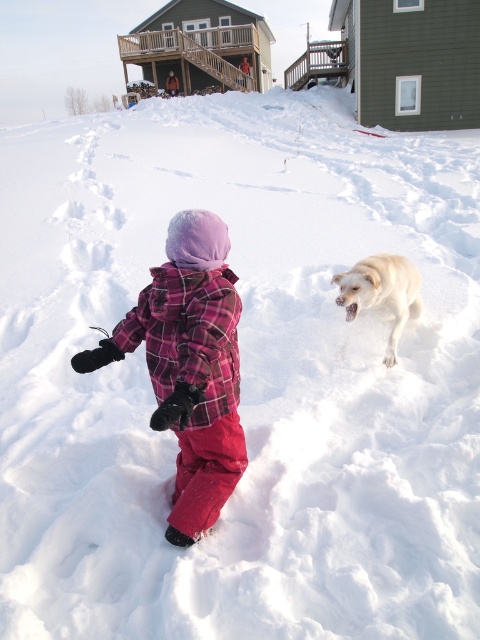
Is point (173, 364) farther from camera compared to point (384, 300)?

No, it is in front of (384, 300).

Is plaid fleece snowsuit at center thinner than light yellow fur at center?

Correct, plaid fleece snowsuit at center's width is less than light yellow fur at center's.

Between point (197, 368) and point (372, 289), which one is positioned behind?

Point (372, 289)

Locate an element on the screen. plaid fleece snowsuit at center is located at coordinates (189, 365).